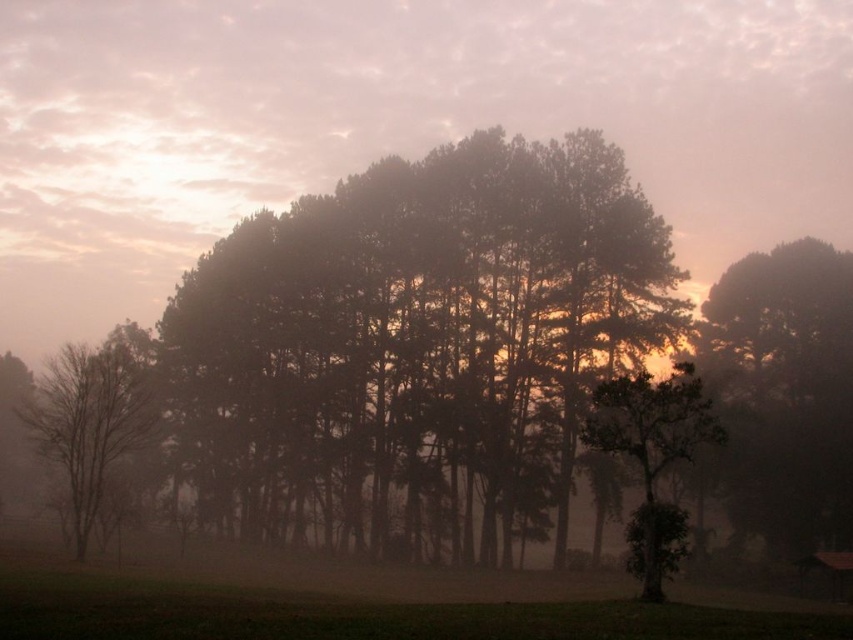
Question: Is dark green textured tree at right to the left of bare wood tree at left from the viewer's perspective?

Choices:
 (A) yes
 (B) no

Answer: (B)

Question: Which point is closer to the camera?

Choices:
 (A) (643, 472)
 (B) (556, 141)
 (C) (131, 452)

Answer: (A)

Question: Can you confirm if bare wood tree at left is positioned below green leafy tree at center?

Choices:
 (A) no
 (B) yes

Answer: (A)

Question: Among these objects, which one is farthest from the camera?

Choices:
 (A) dark green textured tree at right
 (B) bare wood tree at left
 (C) dark green foliage at center

Answer: (A)

Question: Which of the following is the closest to the observer?

Choices:
 (A) (618, 408)
 (B) (45, 372)
 (C) (815, 372)

Answer: (A)

Question: Can you confirm if dark green foliage at center is bigger than green leafy tree at center?

Choices:
 (A) no
 (B) yes

Answer: (B)